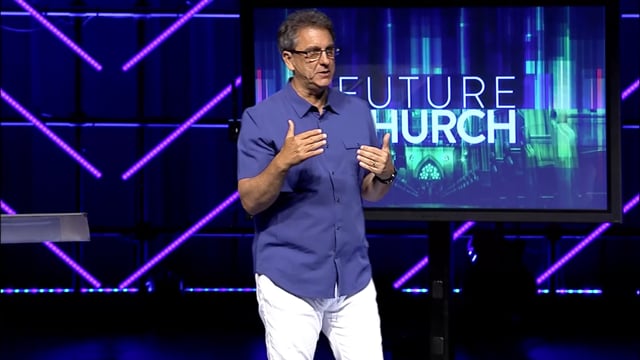
You are a GUI agent. You are given a task and a screenshot of the screen. Output one action in this format:
    pyautogui.click(x=<x>, y=<y>)
    Task: Click on the wall
    This screenshot has height=360, width=640.
    Given the screenshot: What is the action you would take?
    pyautogui.click(x=108, y=125)